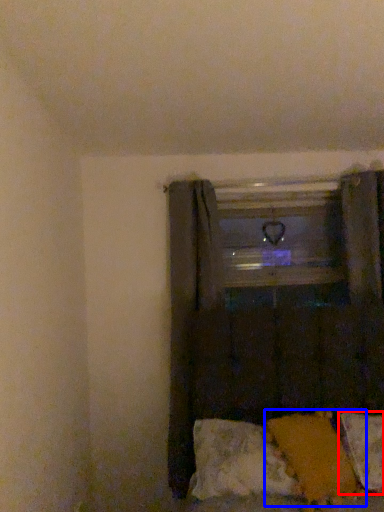
Question: Which of the following is the farthest to the observer, pillow (highlighted by a red box) or pillow (highlighted by a blue box)?

Choices:
 (A) pillow
 (B) pillow

Answer: (A)